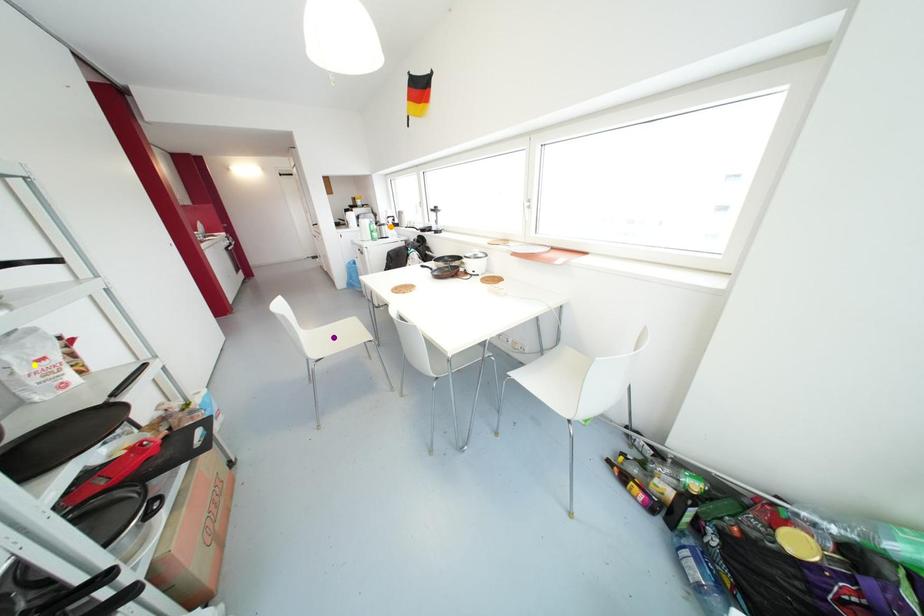
Order these from farthest to nearest:
1. purple point
2. orange point
3. yellow point

orange point, purple point, yellow point